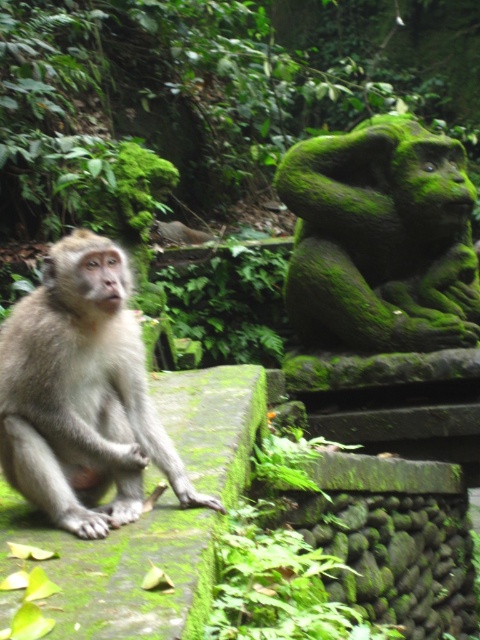
You are a park ranger in the forest and need to determine which object is taller between the green mossy statue at right and the light brown fur monkey at center. Based on the scene, which one is taller?

Answer: The green mossy statue at right is taller than the light brown fur monkey at center according to the description.

You are a hiker who has just arrived at this forest area. You see the green mossy statue at right and the light brown fur monkey at center. Which object is positioned to the east of the other?

The green mossy statue at right is to the right of the light brown fur monkey at center, so the green mossy statue at right is positioned to the east of the light brown fur monkey at center.